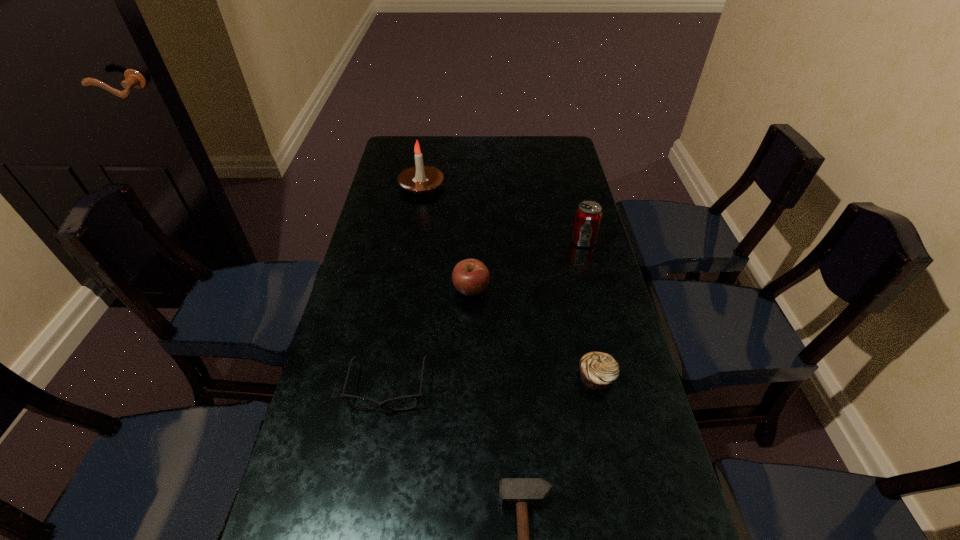
This screenshot has height=540, width=960. I want to click on free space located 0.370m on the side of the third tallest object with the unique marking, so click(468, 433).

Where is `vacant area situated 0.300m on the left of the muffin`? The width and height of the screenshot is (960, 540). vacant area situated 0.300m on the left of the muffin is located at coordinates (x=449, y=377).

Locate an element on the screen. The height and width of the screenshot is (540, 960). vacant point located on the front-facing side of the spectacles is located at coordinates (379, 443).

This screenshot has width=960, height=540. I want to click on candle present at the left edge, so (x=420, y=179).

This screenshot has height=540, width=960. In order to click on spectacles at the left edge in this screenshot , I will do `click(418, 396)`.

I want to click on pop soda at the right edge, so click(x=588, y=215).

Image resolution: width=960 pixels, height=540 pixels. What are the coordinates of `muffin that is at the right edge` in the screenshot? It's located at (598, 370).

Where is `free spot at the far edge of the desktop`? free spot at the far edge of the desktop is located at coordinates (470, 148).

Find the location of a particular element. Image resolution: width=960 pixels, height=540 pixels. free space at the left edge is located at coordinates (324, 531).

Locate an element on the screen. Image resolution: width=960 pixels, height=540 pixels. vacant position at the right edge of the desktop is located at coordinates (611, 334).